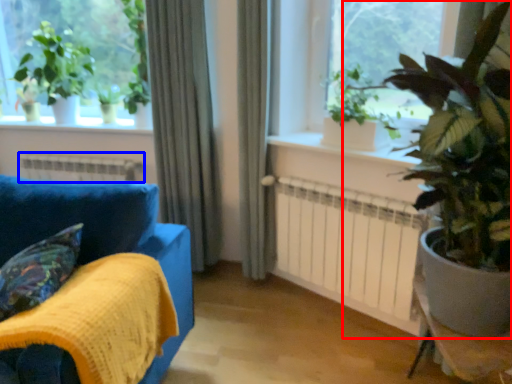
Question: Which point is further to the camera, houseplant (highlighted by a red box) or heater (highlighted by a blue box)?

Choices:
 (A) houseplant
 (B) heater

Answer: (B)